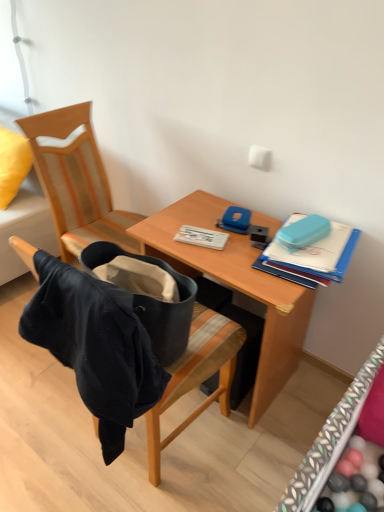
Question: Is white plastic notebook at center touching velvet yellow pillow at upper left?

Choices:
 (A) no
 (B) yes

Answer: (A)

Question: Is velvet yellow pillow at upper left a part of white plastic notebook at center?

Choices:
 (A) yes
 (B) no

Answer: (B)

Question: Can you confirm if white plastic notebook at center is smaller than velvet yellow pillow at upper left?

Choices:
 (A) no
 (B) yes

Answer: (B)

Question: Are white plastic notebook at center and velvet yellow pillow at upper left far apart?

Choices:
 (A) no
 (B) yes

Answer: (B)

Question: From the image's perspective, is white plastic notebook at center located above velvet yellow pillow at upper left?

Choices:
 (A) no
 (B) yes

Answer: (A)

Question: Considering their positions, is velvet black bag at center, the first chair viewed from the front, located in front of or behind white plastic notebook at center?

Choices:
 (A) behind
 (B) front

Answer: (B)

Question: Is velvet black bag at center, the 2th chair from the back, to the left or to the right of white plastic notebook at center in the image?

Choices:
 (A) left
 (B) right

Answer: (A)

Question: Considering the positions of velvet black bag at center, the 2th chair from the back, and white plastic notebook at center in the image, is velvet black bag at center, the 2th chair from the back, wider or thinner than white plastic notebook at center?

Choices:
 (A) wide
 (B) thin

Answer: (A)

Question: In terms of size, does velvet black bag at center, the 2th chair from the back, appear bigger or smaller than white plastic notebook at center?

Choices:
 (A) big
 (B) small

Answer: (A)

Question: Visually, is wooden desk at center positioned to the left or to the right of velvet black bag at center, the 2th chair from the back?

Choices:
 (A) right
 (B) left

Answer: (A)

Question: Looking at their shapes, would you say wooden desk at center is wider or thinner than velvet black bag at center, the first chair viewed from the front?

Choices:
 (A) thin
 (B) wide

Answer: (A)

Question: Is point (150, 244) positioned closer to the camera than point (200, 335)?

Choices:
 (A) farther
 (B) closer

Answer: (A)

Question: From a real-world perspective, is wooden desk at center positioned above or below velvet black bag at center, the first chair viewed from the front?

Choices:
 (A) below
 (B) above

Answer: (A)

Question: Do you think teal plastic case at upper right is within velvet black bag at center, the 2th chair from the back, or outside of it?

Choices:
 (A) outside
 (B) inside

Answer: (A)

Question: From the image's perspective, relative to velvet black bag at center, the first chair viewed from the front, is teal plastic case at upper right above or below?

Choices:
 (A) below
 (B) above

Answer: (B)